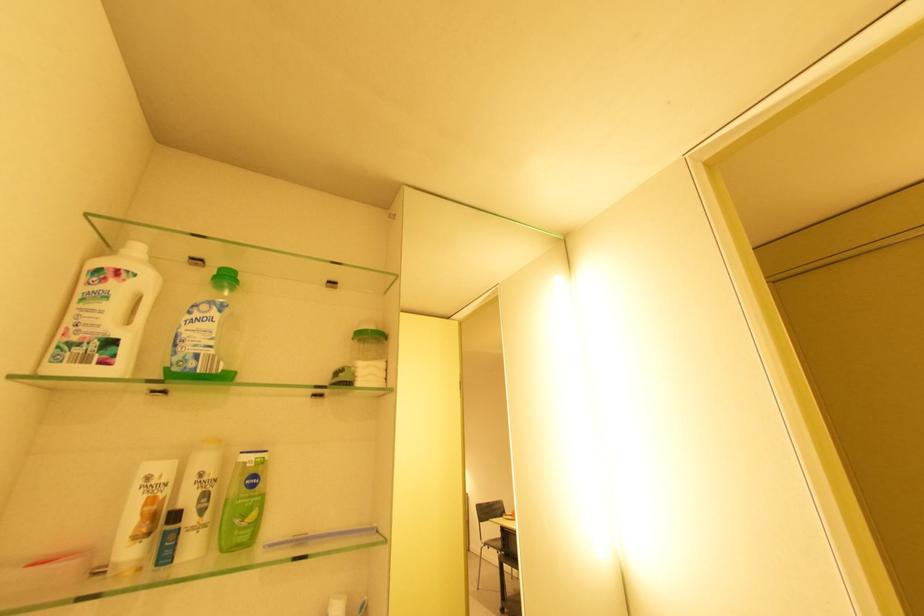
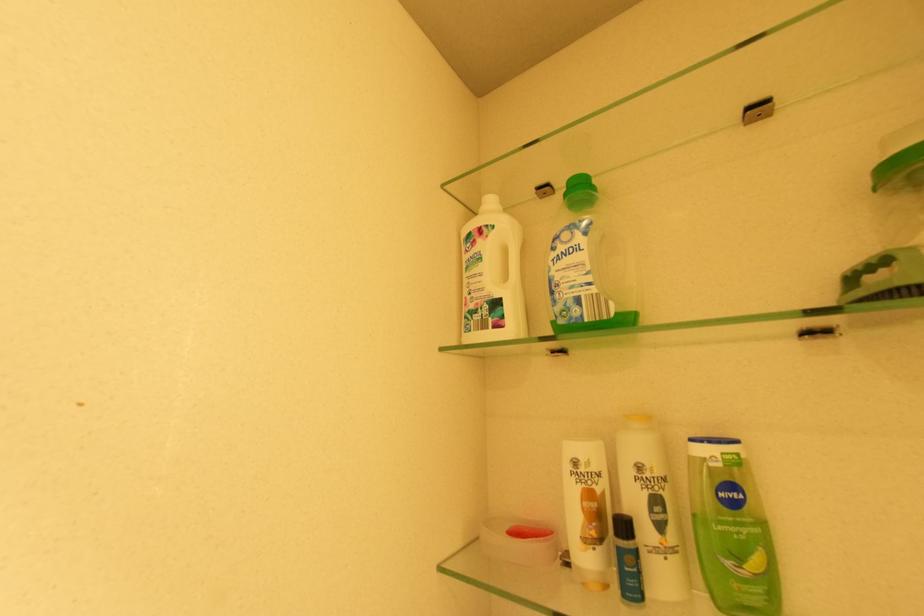
The point at (134, 321) is marked in the first image. Where is the corresponding point in the second image?

(511, 278)